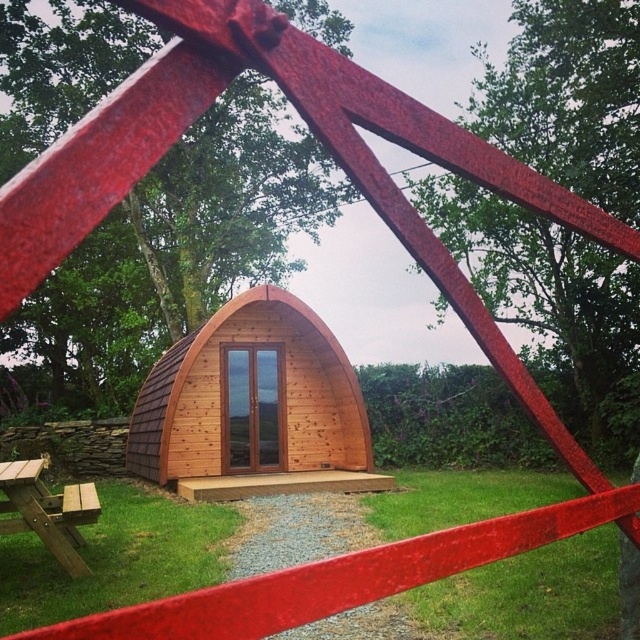
Question: Can you confirm if wooden cabin at center is thinner than wooden picnic table at lower left?

Choices:
 (A) no
 (B) yes

Answer: (A)

Question: Among these points, which one is farthest from the camera?

Choices:
 (A) (172, 385)
 (B) (4, 465)

Answer: (A)

Question: Considering the relative positions of wooden cabin at center and wooden picnic table at lower left in the image provided, where is wooden cabin at center located with respect to wooden picnic table at lower left?

Choices:
 (A) below
 (B) above

Answer: (B)

Question: Among these objects, which one is nearest to the camera?

Choices:
 (A) wooden cabin at center
 (B) wooden picnic table at lower left

Answer: (B)

Question: Among these objects, which one is farthest from the camera?

Choices:
 (A) wooden picnic table at lower left
 (B) wooden cabin at center

Answer: (B)

Question: Observing the image, what is the correct spatial positioning of wooden cabin at center in reference to wooden picnic table at lower left?

Choices:
 (A) above
 (B) below

Answer: (A)